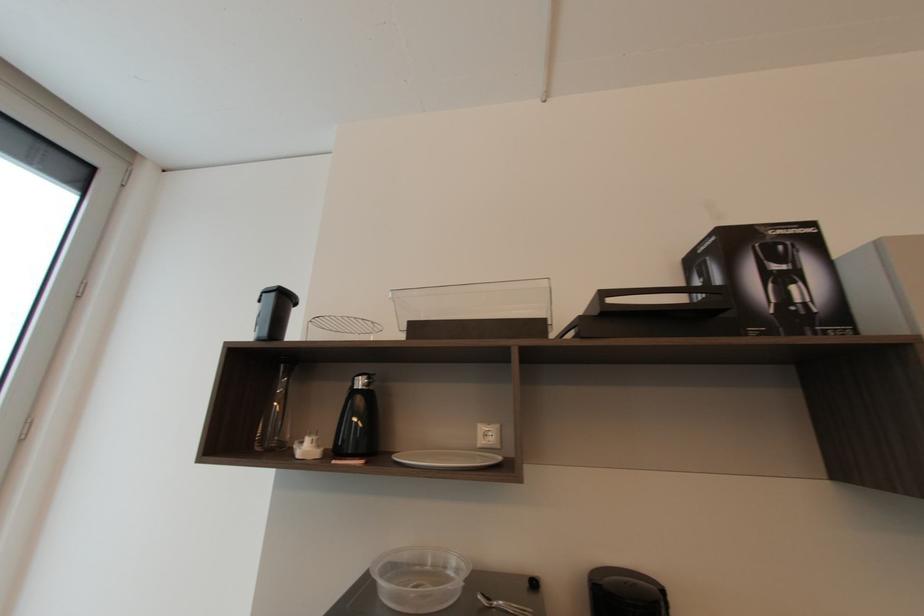
The height and width of the screenshot is (616, 924). I want to click on clear plastic bowl, so point(419,578).